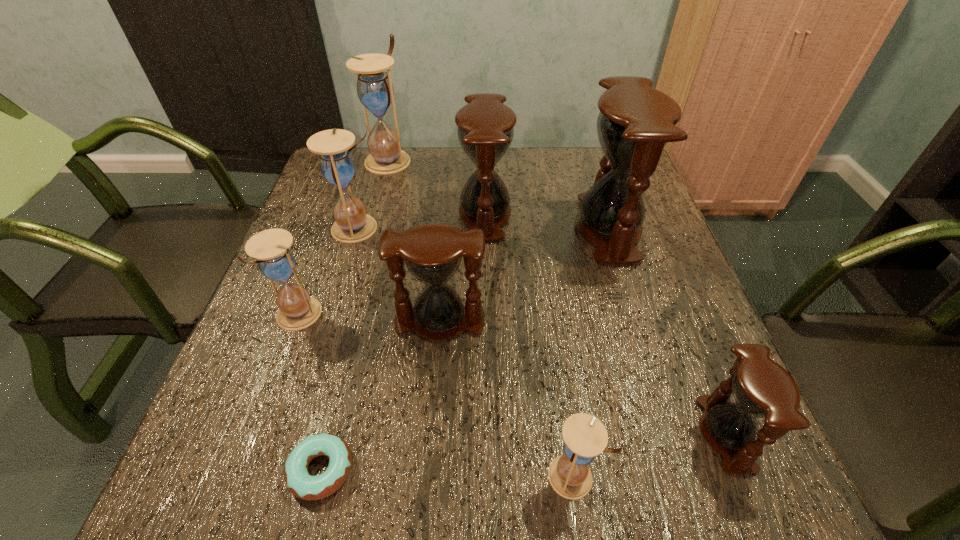
You are a GUI agent. You are given a task and a screenshot of the screen. Output one action in this format:
    pyautogui.click(x=<x>, y=<y>)
    Task: Click on the vacant space located on the back of the blue doughnut
    This screenshot has width=960, height=540.
    Given the screenshot: What is the action you would take?
    pyautogui.click(x=346, y=369)

This screenshot has width=960, height=540. In order to click on doughnut located in the near edge section of the desktop in this screenshot , I will do `click(300, 483)`.

This screenshot has width=960, height=540. I want to click on doughnut at the left edge, so click(x=300, y=483).

The height and width of the screenshot is (540, 960). Identify the location of object that is at the far left corner. (375, 90).

Identify the location of object that is at the near left corner. (300, 483).

Find the location of a particular element. This screenshot has width=960, height=540. object located in the near right corner section of the desktop is located at coordinates (761, 388).

This screenshot has width=960, height=540. What are the coordinates of `blank space at the far edge of the desktop` in the screenshot? It's located at tap(430, 151).

In the image, there is a desktop. Where is `vacant space at the left edge`? vacant space at the left edge is located at coordinates (272, 345).

You are a GUI agent. You are given a task and a screenshot of the screen. Output one action in this format:
    pyautogui.click(x=<x>, y=<y>)
    Task: Click on the vacant space at the right edge of the desktop
    This screenshot has width=960, height=540.
    Given the screenshot: What is the action you would take?
    [x=666, y=260]

I want to click on vacant space at the far right corner of the desktop, so click(x=586, y=151).